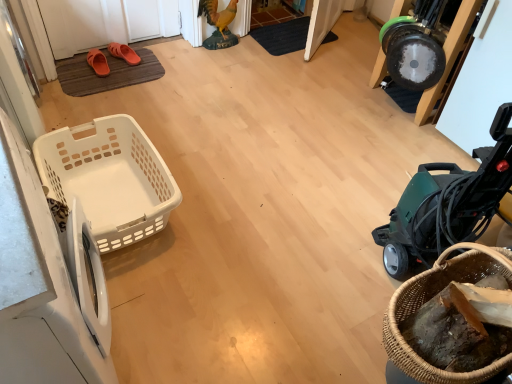
Locate an element on the screen. This screenshot has width=512, height=384. free area below white plastic basket at left, the 1th basket viewed from the left (from a real-world perspective) is located at coordinates (113, 202).